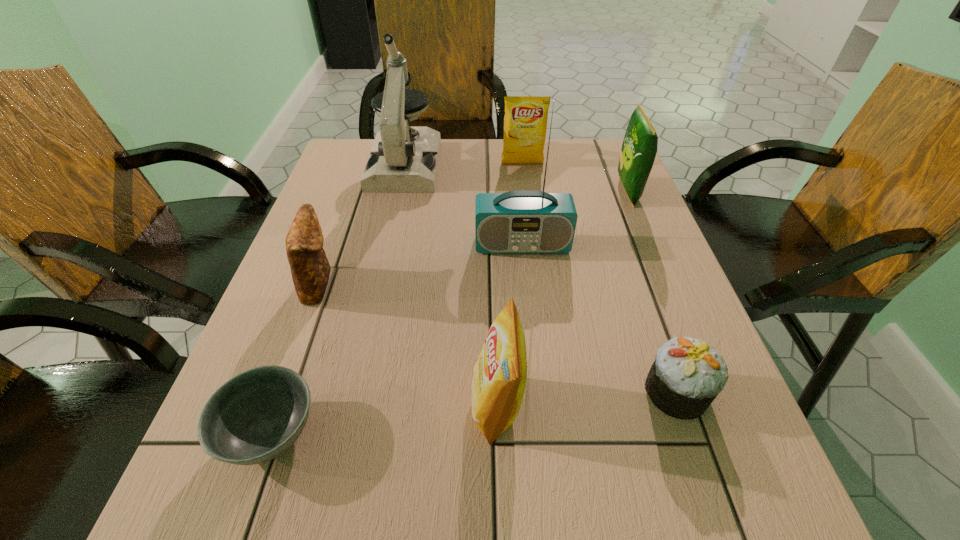
The image size is (960, 540). Find the location of `vacant space located on the right of the bowl`. vacant space located on the right of the bowl is located at coordinates (502, 433).

Locate an element on the screen. The width and height of the screenshot is (960, 540). microscope at the far edge is located at coordinates (403, 159).

You are a GUI agent. You are given a task and a screenshot of the screen. Output one action in this format:
    pyautogui.click(x=<x>, y=<y>)
    Task: Click on the object located in the near edge section of the desktop
    The height and width of the screenshot is (540, 960).
    Given the screenshot: What is the action you would take?
    point(255,416)

The height and width of the screenshot is (540, 960). I want to click on microscope positioned at the left edge, so click(x=403, y=159).

You are a GUI agent. You are given a task and a screenshot of the screen. Output one action in this format:
    pyautogui.click(x=<x>, y=<y>)
    Task: Click on the clutch bag that is at the left edge
    
    Given the screenshot: What is the action you would take?
    pyautogui.click(x=310, y=269)

Locate an element on the screen. The width and height of the screenshot is (960, 540). bowl located at the left edge is located at coordinates (255, 416).

Find the location of a particular element. crisp (potato chip) located at the right edge is located at coordinates (639, 148).

Where is `cupcake present at the right edge`? This screenshot has height=540, width=960. cupcake present at the right edge is located at coordinates tap(687, 375).

Find the location of a particular element. object located in the far left corner section of the desktop is located at coordinates (403, 159).

Locate an element on the screen. This screenshot has width=960, height=540. object located at the near left corner is located at coordinates (255, 416).